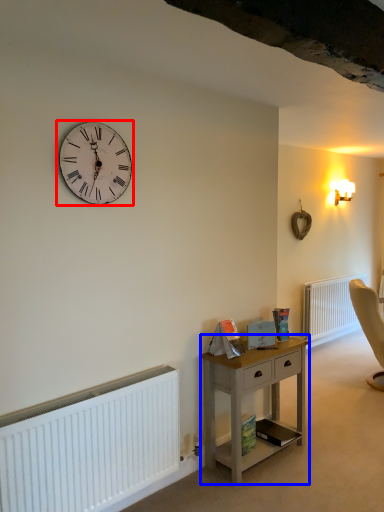
Question: Which object appears closest to the camera in this image, wall clock (highlighted by a red box) or nightstand (highlighted by a blue box)?

Choices:
 (A) wall clock
 (B) nightstand

Answer: (A)